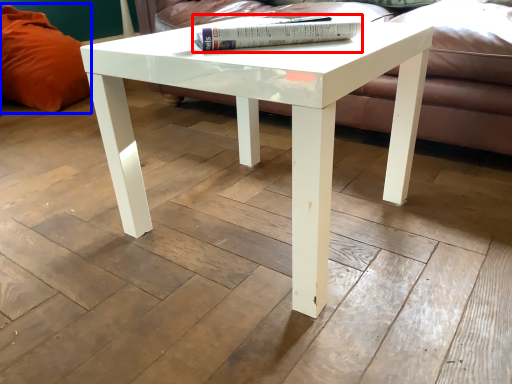
Question: Which object is further to the camera taking this photo, book (highlighted by a red box) or pillow (highlighted by a blue box)?

Choices:
 (A) book
 (B) pillow

Answer: (B)